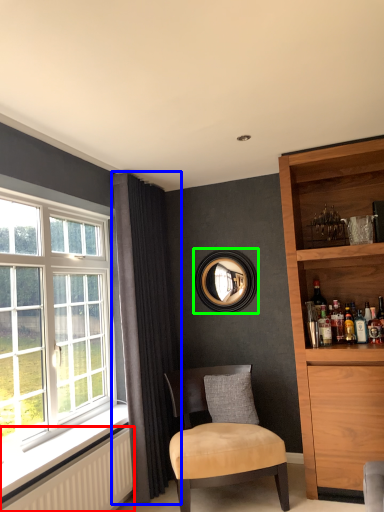
Question: Estimate the real-world distances between objects in this image. Which object is farther from radiator (highlighted by a red box), curtain (highlighted by a blue box) or picture frame (highlighted by a green box)?

Choices:
 (A) curtain
 (B) picture frame

Answer: (B)